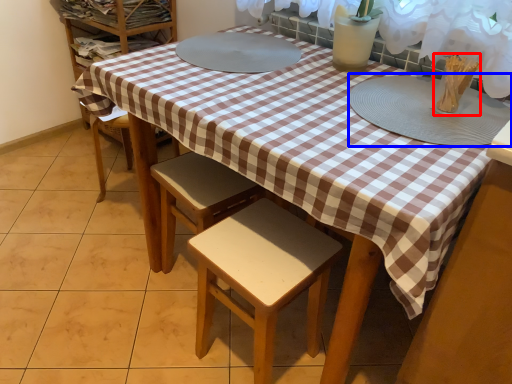
Question: Which point is further to the camera, tableware (highlighted by a red box) or platter (highlighted by a blue box)?

Choices:
 (A) tableware
 (B) platter

Answer: (A)